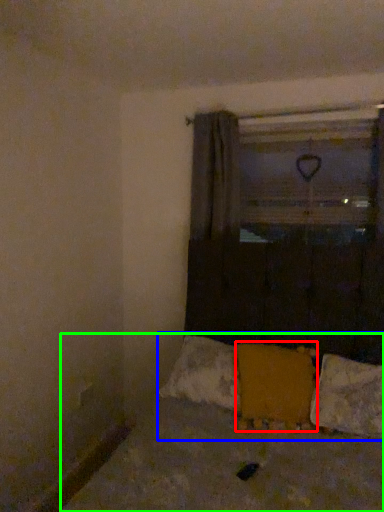
Question: Which object is the closest to the pillow (highlighted by a red box)? Choose among these: bedding (highlighted by a blue box) or bed (highlighted by a green box).

Choices:
 (A) bedding
 (B) bed

Answer: (A)